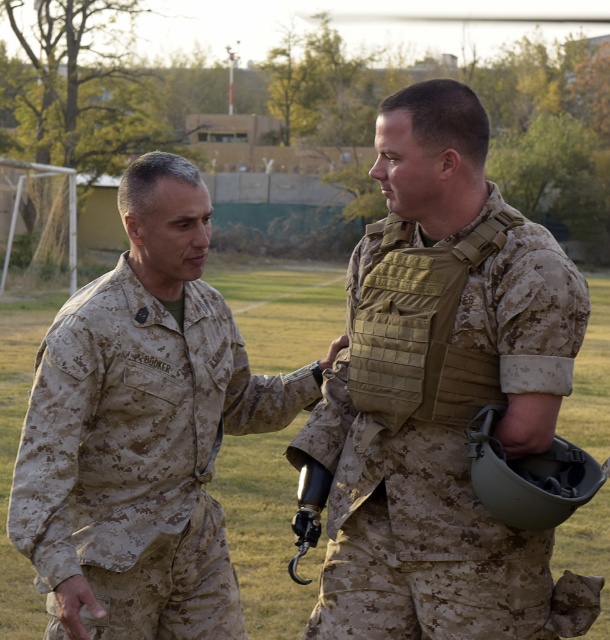
Between camouflage fabric vest at center and camouflage uniform at left, which one has less height?

camouflage uniform at left is shorter.

Find the location of `camouflage fabric vest at center`. camouflage fabric vest at center is located at coordinates (442, 394).